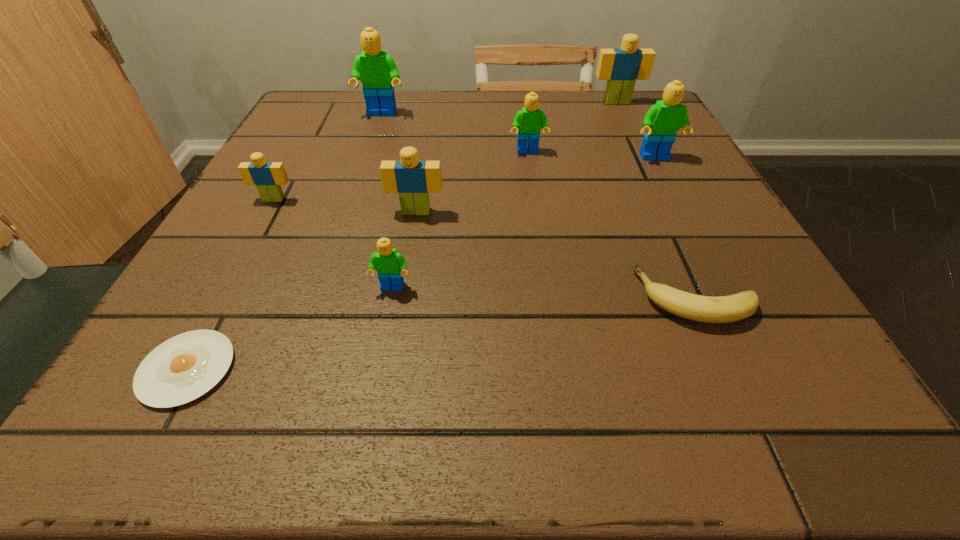
I want to click on the biggest green Lego, so click(x=377, y=71).

At what (x,y) coordinates should I click in order to perform the action: click on the sixth Lego from right to left. Please return your answer as a coordinate pair (x, y). Looking at the image, I should click on 377,71.

Image resolution: width=960 pixels, height=540 pixels. Identify the location of the farthest Lego. (621, 67).

At what (x,y) coordinates should I click in order to perform the action: click on the rightmost beige Lego. Please return your answer as a coordinate pair (x, y). The width and height of the screenshot is (960, 540). Looking at the image, I should click on (621, 67).

Where is `the second biggest green Lego`? The width and height of the screenshot is (960, 540). the second biggest green Lego is located at coordinates (662, 121).

This screenshot has width=960, height=540. Identify the location of the nearest beige Lego. (413, 179).

Where is `the second smallest beige Lego`? The width and height of the screenshot is (960, 540). the second smallest beige Lego is located at coordinates (413, 179).

This screenshot has height=540, width=960. What are the coordinates of `the fourth object from right to left` in the screenshot? It's located at (530, 120).

Locate an element on the screen. The image size is (960, 540). the third biggest green Lego is located at coordinates (530, 120).

In order to click on the leftmost beige Lego in this screenshot , I will do `click(268, 177)`.